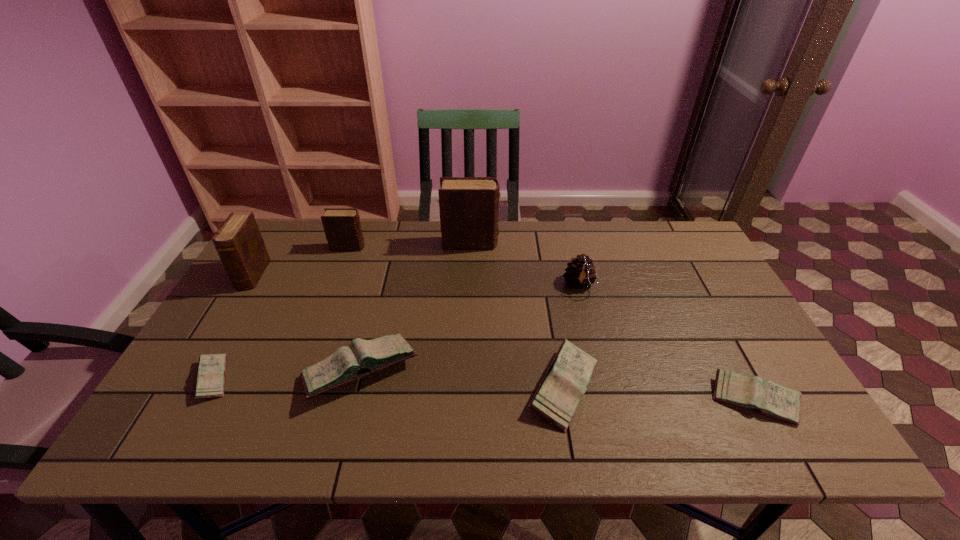
The height and width of the screenshot is (540, 960). Identify the location of free spot between the pinecone and the fifth tallest object. (470, 328).

Locate an element on the screen. The width and height of the screenshot is (960, 540). object that stands as the fourth closest to the third smallest pink diary is located at coordinates (469, 206).

Locate an element on the screen. object that is the closest one to the smallest pink diary is located at coordinates (x=363, y=357).

Where is `diary that is the second closest to the third farthest diary`? The height and width of the screenshot is (540, 960). diary that is the second closest to the third farthest diary is located at coordinates (210, 382).

The image size is (960, 540). What are the coordinates of `diary object that ranks as the fifth closest to the seventh tallest object` in the screenshot? It's located at (210, 382).

Point out which brown diary is positioned as the nearest to the leftmost pink diary. Please provide its 2D coordinates. Your answer should be formatted as a tuple, i.e. [(x, y)], where the tuple contains the x and y coordinates of a point satisfying the conditions above.

[(238, 241)]

Identify which brown diary is located as the second nearest to the third farthest diary. Please provide its 2D coordinates. Your answer should be formatted as a tuple, i.e. [(x, y)], where the tuple contains the x and y coordinates of a point satisfying the conditions above.

[(469, 206)]

This screenshot has width=960, height=540. Find the location of `pink diary that is the closest to the fourth tallest diary`. pink diary that is the closest to the fourth tallest diary is located at coordinates (210, 382).

Where is `pink diary identified as the closest to the brown pinecone`? The width and height of the screenshot is (960, 540). pink diary identified as the closest to the brown pinecone is located at coordinates (556, 399).

The image size is (960, 540). I want to click on vacant space that satisfies the following two spatial constraints: 1. on the front side of the fourth shortest diary; 2. on the right side of the sixth diary from left to right, so click(x=357, y=387).